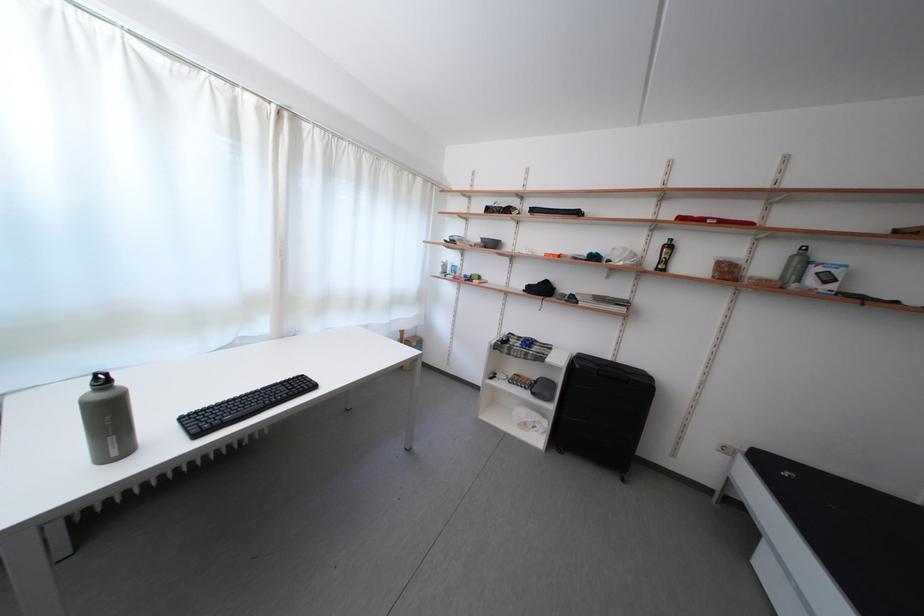
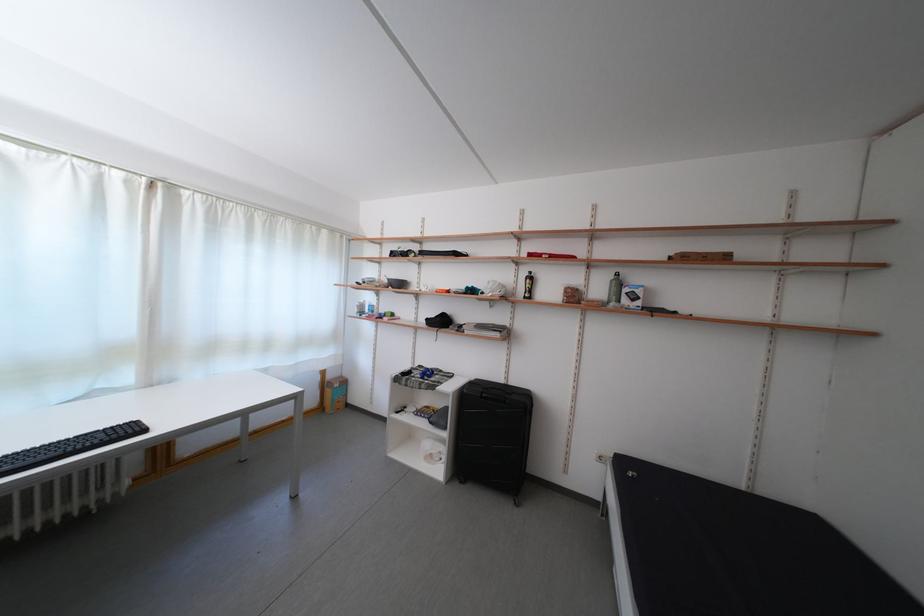
Question: Which direction would the cameraman need to move to produce the second image? Reply with the corresponding letter.

Choices:
 (A) Left
 (B) Right
 (C) Forward
 (D) Backward

Answer: (B)